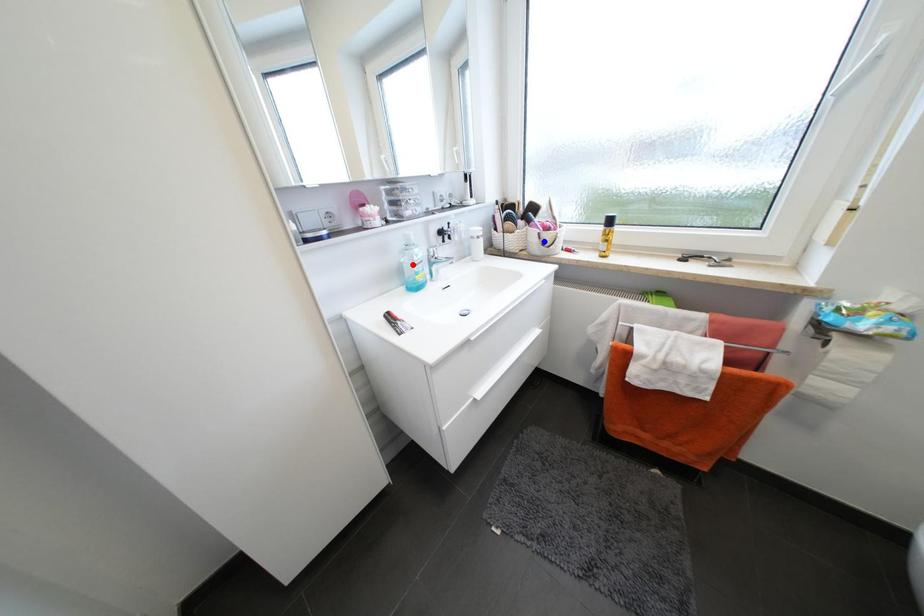
Question: In the image, two points are highlighted. Which point is nearer to the camera? Reply with the corresponding letter.

Choices:
 (A) blue point
 (B) red point

Answer: (B)